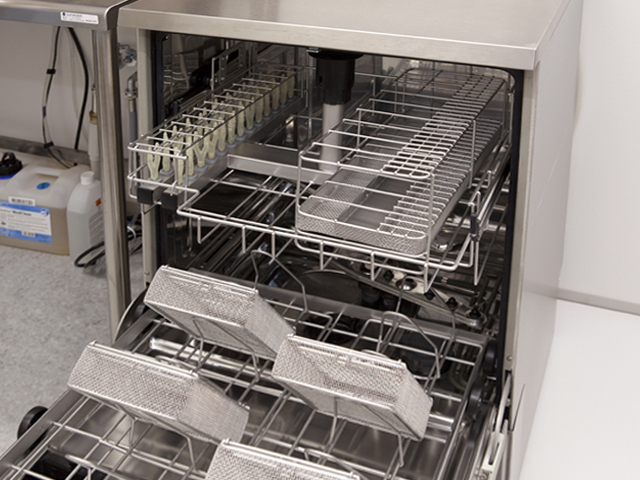
The height and width of the screenshot is (480, 640). In order to click on jug in this screenshot , I will do `click(31, 221)`, `click(86, 217)`.